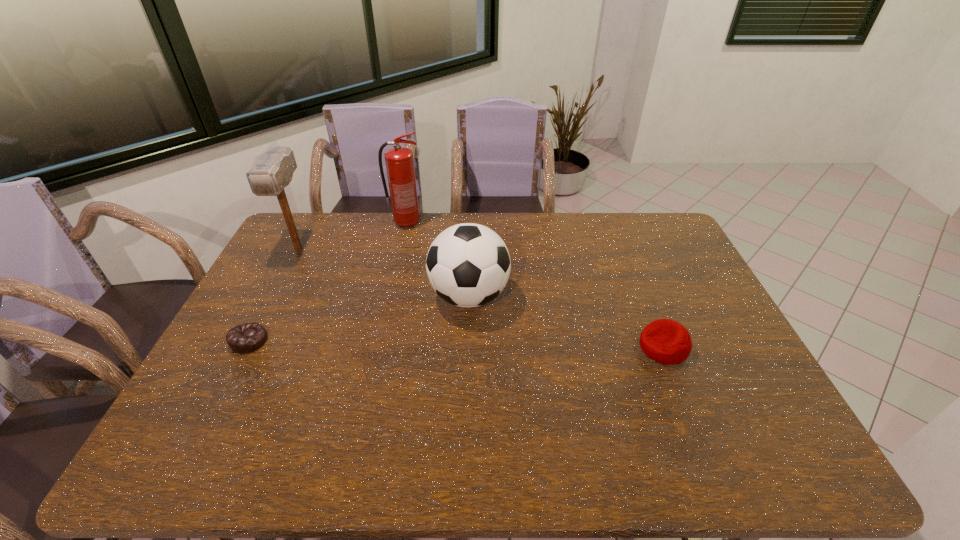
Find the location of a particular element. vacant space located on the striking face of the second farthest object is located at coordinates (254, 337).

Find the location of a particular element. The image size is (960, 540). vacant space situated on the left of the fourth object from left to right is located at coordinates (328, 296).

Image resolution: width=960 pixels, height=540 pixels. Identify the location of vacant point located on the seat area of the fourth tallest object. (593, 347).

This screenshot has height=540, width=960. I want to click on vacant region located on the seat area of the fourth tallest object, so click(x=562, y=347).

Find the location of `free point located on the seat area of the fourth tallest object`. free point located on the seat area of the fourth tallest object is located at coordinates pos(525,347).

Image resolution: width=960 pixels, height=540 pixels. I want to click on vacant space situated on the right of the shortest object, so click(288, 341).

This screenshot has width=960, height=540. What are the coordinates of `fire extinguisher that is at the far edge` in the screenshot? It's located at (399, 160).

You are a GUI agent. You are given a task and a screenshot of the screen. Output one action in this format:
    pyautogui.click(x=<x>, y=<y>)
    Task: Click on the mallet at the far edge
    
    Given the screenshot: What is the action you would take?
    pyautogui.click(x=271, y=171)

The height and width of the screenshot is (540, 960). I want to click on mallet that is at the left edge, so click(x=271, y=171).

I want to click on beanbag present at the left edge, so click(x=246, y=338).